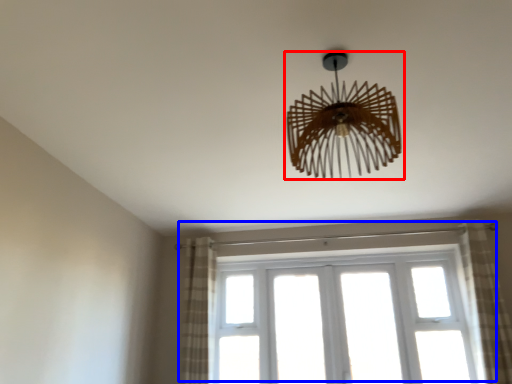
Question: Which object appears farthest to the camera in this image, lamp (highlighted by a red box) or window (highlighted by a blue box)?

Choices:
 (A) lamp
 (B) window

Answer: (B)